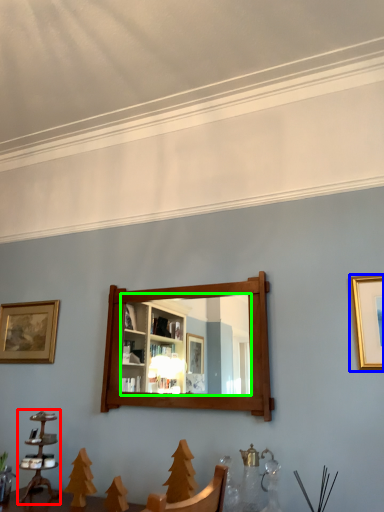
Question: Which object is the closest to the candle holder (highlighted by a red box)? Choose among these: picture frame (highlighted by a blue box) or mirror (highlighted by a green box).

Choices:
 (A) picture frame
 (B) mirror

Answer: (B)